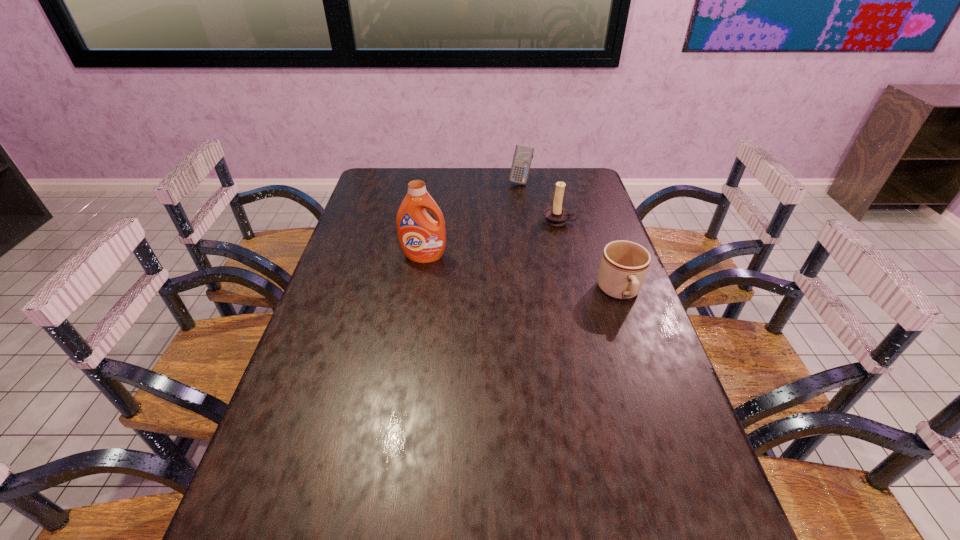
This screenshot has width=960, height=540. I want to click on the leftmost object, so coord(422,239).

Identify the location of the tallest object. (422, 239).

The image size is (960, 540). Identify the location of the rightmost object. click(x=624, y=264).

In order to click on the shortest object in this screenshot , I will do `click(624, 264)`.

Find the location of a particular element. The width and height of the screenshot is (960, 540). candle holder is located at coordinates (557, 215).

The image size is (960, 540). What are the coordinates of `the third nearest object` in the screenshot? It's located at 557,215.

Identify the location of calculator. (523, 155).

This screenshot has width=960, height=540. Find the location of `the farthest object`. the farthest object is located at coordinates (523, 155).

Image resolution: width=960 pixels, height=540 pixels. I want to click on vacant space located 0.370m on the front-facing side of the tallest object, so [409, 357].

Identify the location of vacant point located 0.280m on the side of the shortest object with the handle. (659, 402).